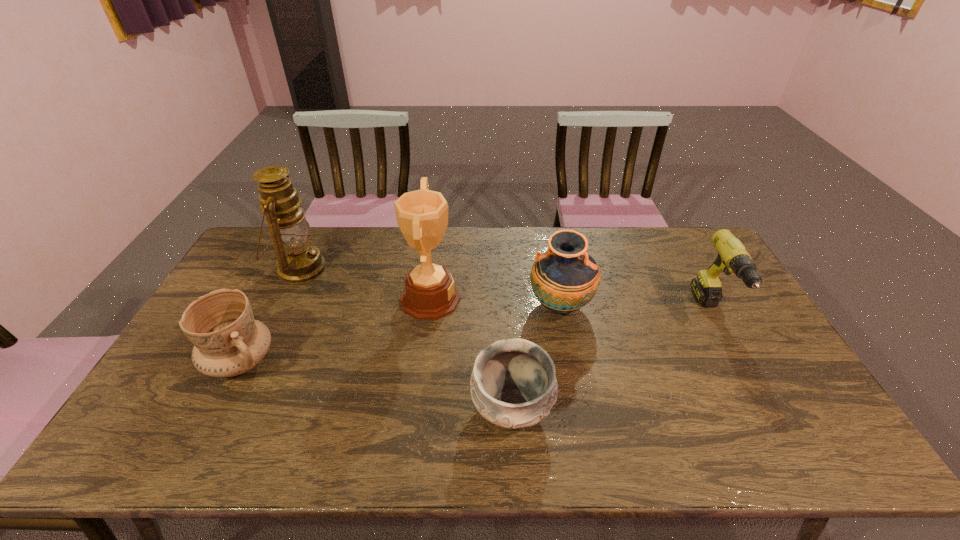
What are the coordinates of `oil lamp` in the screenshot? It's located at (298, 261).

This screenshot has height=540, width=960. I want to click on award, so click(x=430, y=293).

At what (x,y) coordinates should I click in order to perform the action: click on the farthest pottery. Please return your answer as a coordinate pair (x, y). This screenshot has height=540, width=960. Looking at the image, I should click on (565, 278).

The height and width of the screenshot is (540, 960). What are the coordinates of `the rightmost object` in the screenshot? It's located at (732, 257).

Locate an element on the screen. This screenshot has width=960, height=540. the fifth tallest object is located at coordinates (228, 341).

This screenshot has width=960, height=540. I want to click on the leftmost pottery, so click(228, 341).

Identify the location of the shortest object. (513, 385).

At what (x,y) coordinates should I click in order to perform the action: click on free space located 0.250m on the front of the oil lamp. Please return your answer as a coordinate pair (x, y). The width and height of the screenshot is (960, 540). Looking at the image, I should click on (258, 354).

Locate an element on the screen. vacant area situated on the front-facing side of the third object from left to right is located at coordinates pyautogui.click(x=505, y=299).

Where is `free point located on the front of the tallest pottery`? Image resolution: width=960 pixels, height=540 pixels. free point located on the front of the tallest pottery is located at coordinates (582, 415).